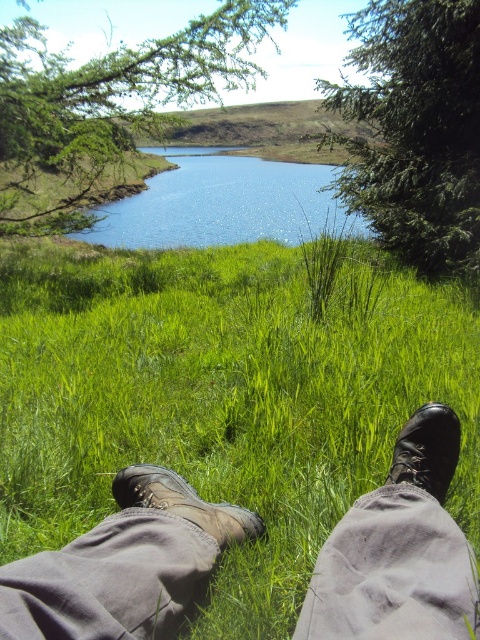
You are standing in the scene and want to step onto the blue glassy water at center without getting your leather boots at lower center wet. Which direction should you move your boots to avoid stepping into the water?

The leather boots at lower center is to the right of blue glassy water at center. To avoid stepping into the water, you should move your boots to the left away from the water.

You are a photographer trying to capture both the leather boots at lower center and the black leather boot at lower right in a single frame. Which boot should you focus on first to ensure both are in the frame?

You should focus on the leather boots at lower center first because it is larger in size compared to the black leather boot at lower right, ensuring it fits within the frame while adjusting for the smaller boot.

You are standing in the scene and want to take a photo of the blue glassy water at center without the leather boots at lower center appearing in the frame. How should you adjust your position?

Move backward away from the leather boots at lower center so the blue glassy water at center comes into focus while the boots become smaller in the frame, ensuring they are not obstructing the view.